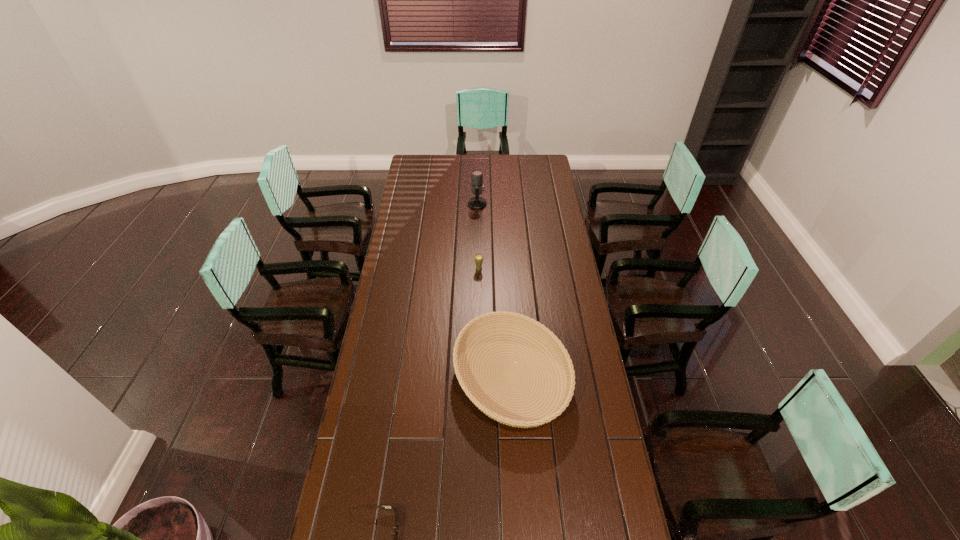
The height and width of the screenshot is (540, 960). What are the coordinates of `the tallest object` in the screenshot? It's located at (477, 186).

Image resolution: width=960 pixels, height=540 pixels. I want to click on microphone, so click(x=477, y=186).

You are a GUI agent. You are given a task and a screenshot of the screen. Output one action in this format:
    pyautogui.click(x=<x>, y=<y>)
    Task: Click on the second tallest object
    
    Given the screenshot: What is the action you would take?
    pyautogui.click(x=478, y=258)

You are a GUI agent. You are given a task and a screenshot of the screen. Output one action in this format:
    pyautogui.click(x=<x>, y=<y>)
    Task: Click on the straw for drinking
    Image resolution: width=960 pixels, height=540 pixels.
    Given the screenshot: What is the action you would take?
    pyautogui.click(x=478, y=258)

Where is `basket`? basket is located at coordinates (552, 407).

At what (x,y) coordinates should I click in order to perform the action: click on the third tallest object. Please return your answer as a coordinate pair (x, y). Image resolution: width=960 pixels, height=540 pixels. Looking at the image, I should click on (552, 407).

I want to click on free space located 0.080m on the side of the farthest object with the red ring, so click(501, 204).

Image resolution: width=960 pixels, height=540 pixels. I want to click on vacant space situated 0.190m on the left of the straw for drinking, so click(x=434, y=269).

This screenshot has height=540, width=960. I want to click on free space located 0.140m on the back of the second nearest object, so click(x=507, y=301).

Locate an element on the screen. The width and height of the screenshot is (960, 540). object at the right edge is located at coordinates (552, 407).